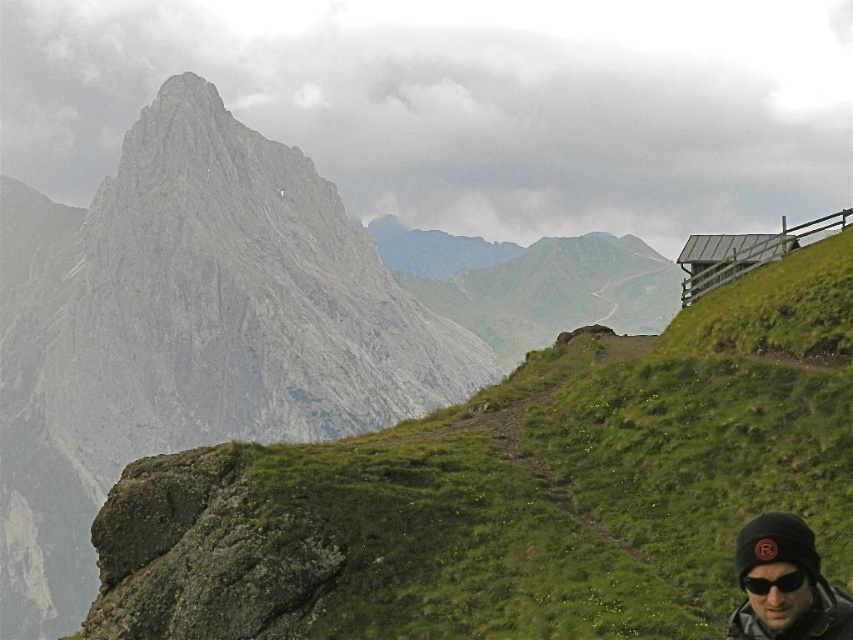
Can you confirm if green grassy at upper center is bigger than black matte sunglasses at lower right?

Yes.

Where is `green grassy at upper center`? The height and width of the screenshot is (640, 853). green grassy at upper center is located at coordinates (515, 492).

Is gray rock mountain at upper left above black matte sunglasses at lower right?

Incorrect, gray rock mountain at upper left is not positioned above black matte sunglasses at lower right.

Identify the location of gray rock mountain at upper left. The width and height of the screenshot is (853, 640). (187, 332).

What do you see at coordinates (187, 332) in the screenshot?
I see `gray rock mountain at upper left` at bounding box center [187, 332].

You are a GUI agent. You are given a task and a screenshot of the screen. Output one action in this format:
    pyautogui.click(x=<x>, y=<y>)
    Task: Click on the gray rock mountain at upper left
    
    Given the screenshot: What is the action you would take?
    [187, 332]

Is point (167, 524) closer to camera compared to point (828, 621)?

That is False.

Is point (686, 424) positioned behind point (758, 637)?

Yes, point (686, 424) is farther from viewer.

At what (x,y) coordinates should I click in order to perform the action: click on green grassy at upper center. Please return your answer as a coordinate pair (x, y). Looking at the image, I should click on (515, 492).

The image size is (853, 640). Identify the location of green grassy at upper center. (515, 492).